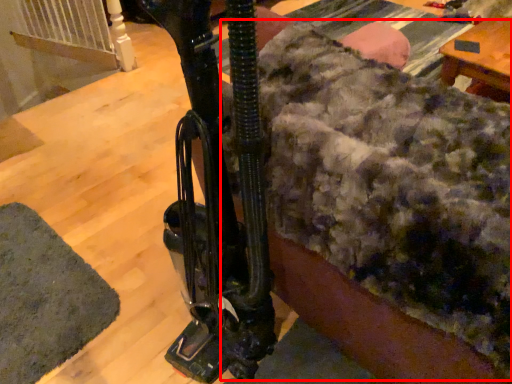
Question: From the image's perspective, what is the correct spatial relationship of blanket (annotated by the red box) in relation to mat?

Choices:
 (A) below
 (B) above

Answer: (B)